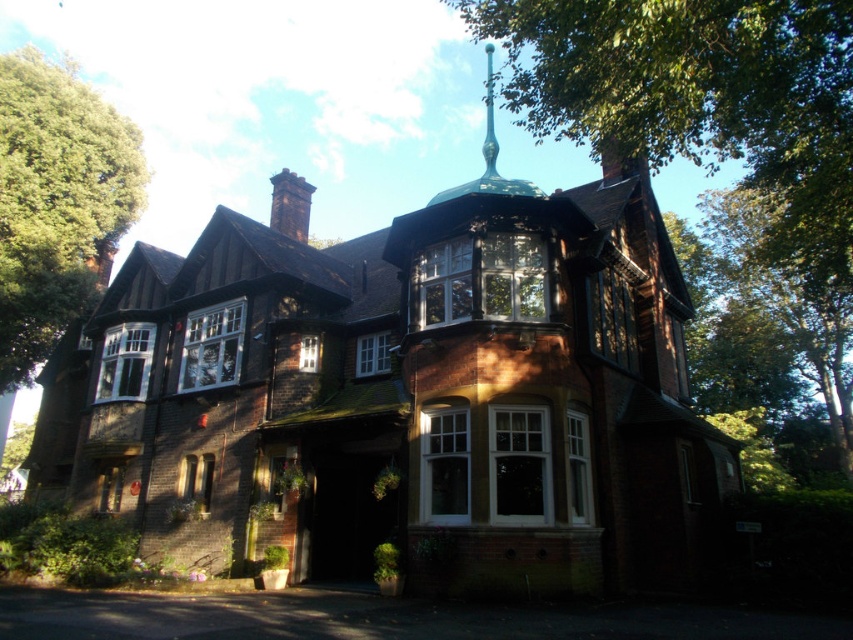
Question: Is green leafy tree at upper center wider than green leafy tree at upper left?

Choices:
 (A) no
 (B) yes

Answer: (B)

Question: Which point is farther to the camera?

Choices:
 (A) green leafy tree at upper left
 (B) green leafy tree at upper center

Answer: (A)

Question: Which point is closer to the camera?

Choices:
 (A) green leafy tree at upper center
 (B) green leafy tree at upper left

Answer: (A)

Question: Considering the relative positions of green leafy tree at upper center and green leafy tree at upper left in the image provided, where is green leafy tree at upper center located with respect to green leafy tree at upper left?

Choices:
 (A) left
 (B) right

Answer: (B)

Question: Is green leafy tree at upper center below green leafy tree at upper left?

Choices:
 (A) yes
 (B) no

Answer: (B)